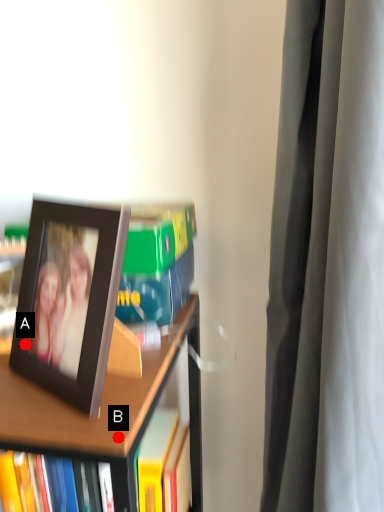
Question: Two points are circled on the image, labeled by A and B beside each circle. Which point is further to the camera?

Choices:
 (A) A is further
 (B) B is further

Answer: (A)